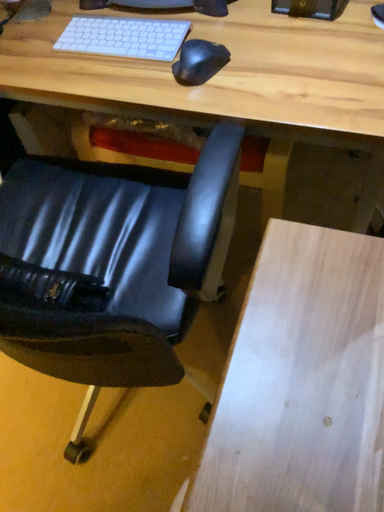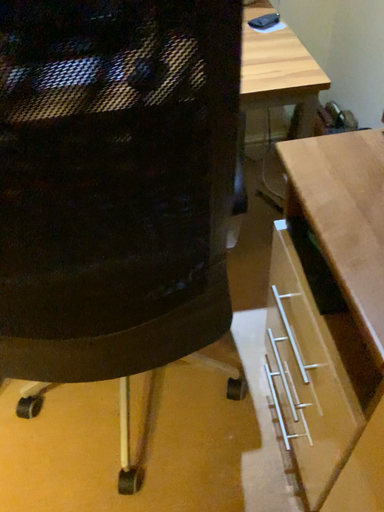
Question: How did the camera likely rotate when shooting the video?

Choices:
 (A) rotated left
 (B) rotated right

Answer: (B)